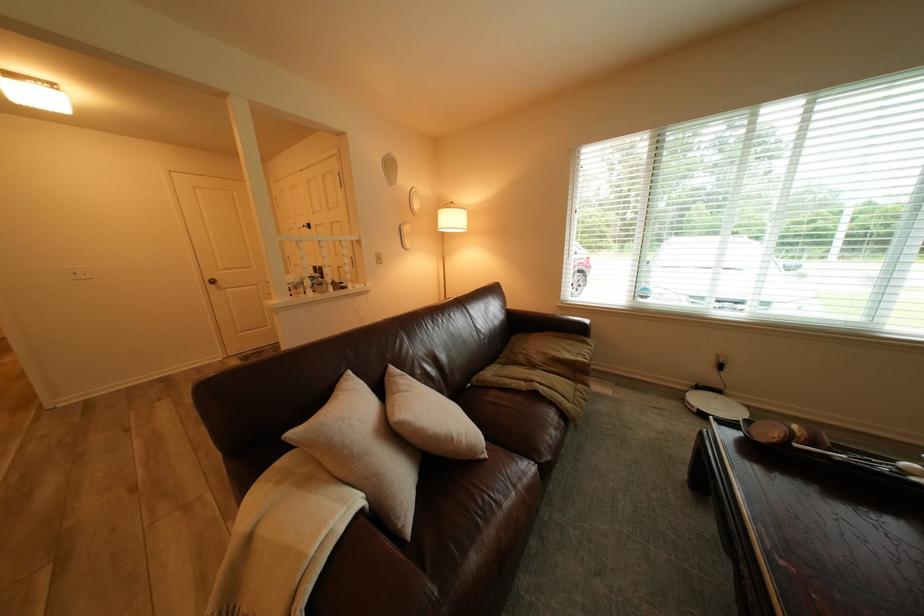
Locate an element on the screen. This screenshot has width=924, height=616. sofa sitting surface is located at coordinates coord(441,419).